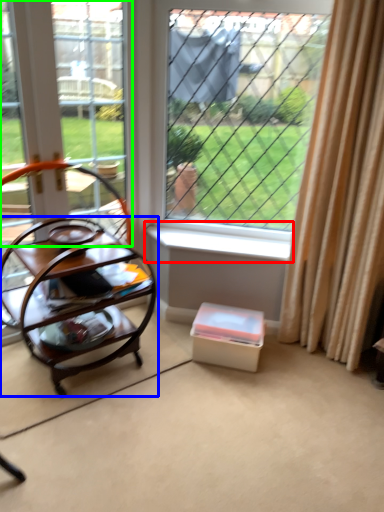
Question: Which is farther away from window sill (highlighted by a red box)? table (highlighted by a blue box) or window frame (highlighted by a green box)?

Choices:
 (A) table
 (B) window frame

Answer: (B)